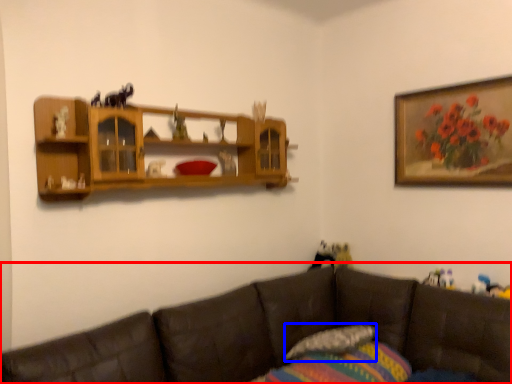
Question: Which object is closer to the camera taking this photo, studio couch (highlighted by a red box) or pillow (highlighted by a blue box)?

Choices:
 (A) studio couch
 (B) pillow

Answer: (A)